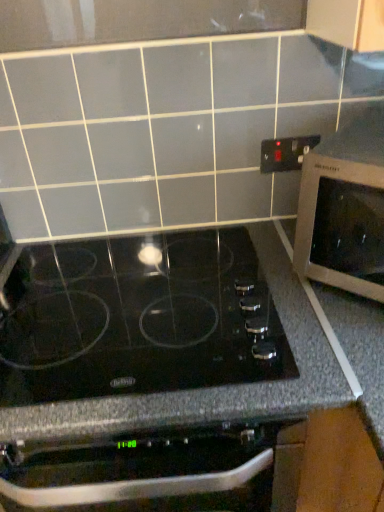
Question: Considering the positions of black glass cooktop at center and black plastic electrical outlet at upper right in the image, is black glass cooktop at center taller or shorter than black plastic electrical outlet at upper right?

Choices:
 (A) tall
 (B) short

Answer: (A)

Question: Considering the positions of point (26, 396) and point (274, 164), is point (26, 396) closer or farther from the camera than point (274, 164)?

Choices:
 (A) closer
 (B) farther

Answer: (A)

Question: Which of these objects is positioned closest to the silver metallic microwave at right?

Choices:
 (A) black plastic electrical outlet at upper right
 (B) black glass cooktop at center

Answer: (B)

Question: Which object is the closest to the silver metallic microwave at right?

Choices:
 (A) black plastic electrical outlet at upper right
 (B) black glass cooktop at center

Answer: (B)